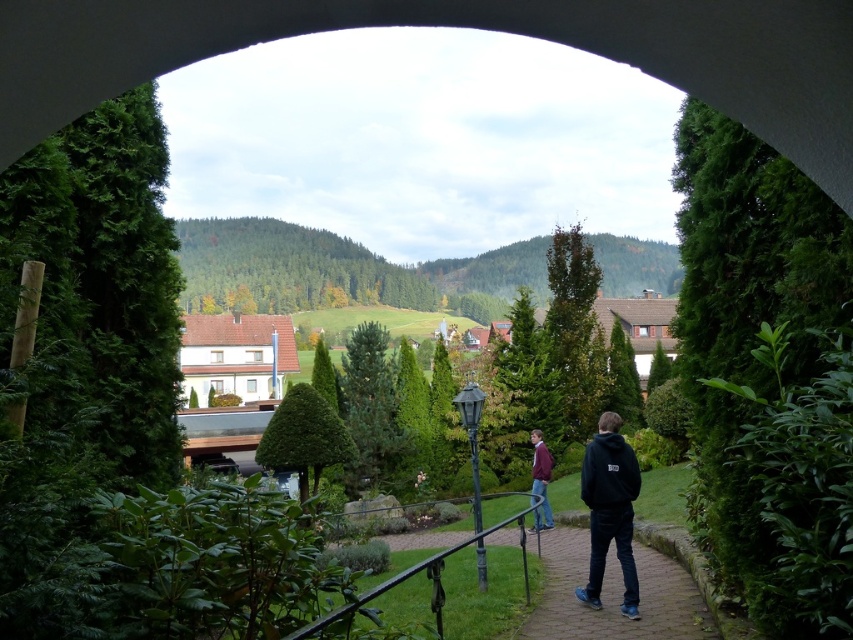
Which is more to the right, brick paved path at center or black wrought iron rail at center?

brick paved path at center

Locate an element on the screen. brick paved path at center is located at coordinates (614, 595).

You are a GUI agent. You are given a task and a screenshot of the screen. Output one action in this format:
    pyautogui.click(x=<x>, y=<y>)
    Task: Click on the brick paved path at center
    The image size is (853, 640).
    Given the screenshot: What is the action you would take?
    pyautogui.click(x=614, y=595)

Is green leafy hedge at right to the left of brick paved path at center from the viewer's perspective?

In fact, green leafy hedge at right is to the right of brick paved path at center.

Does green leafy hedge at right appear over brick paved path at center?

Indeed, green leafy hedge at right is positioned over brick paved path at center.

Which is in front, point (828, 506) or point (650, 560)?

Point (828, 506) is more forward.

The height and width of the screenshot is (640, 853). I want to click on green leafy hedge at right, so click(x=769, y=372).

Is brick paved path at center taller than maroon sweater at center?

Indeed, brick paved path at center has a greater height compared to maroon sweater at center.

Who is positioned more to the left, brick paved path at center or maroon sweater at center?

brick paved path at center is more to the left.

Is point (605, 593) less distant than point (544, 506)?

Yes, it is in front of point (544, 506).

Image resolution: width=853 pixels, height=640 pixels. Find the location of `brick paved path at center`. brick paved path at center is located at coordinates (614, 595).